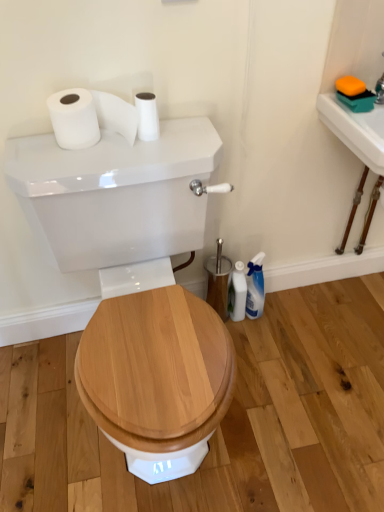
Image resolution: width=384 pixels, height=512 pixels. Find the location of `free space that is in between white glossy toilet tank at center and white glossy toilet brush at lower right`. free space that is in between white glossy toilet tank at center and white glossy toilet brush at lower right is located at coordinates (245, 380).